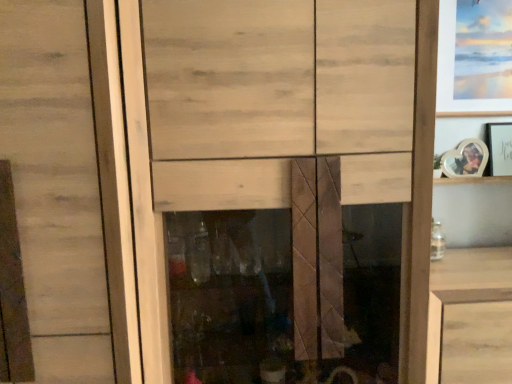
Question: Is wooden heart-shaped photo frame at upper right, which is counted as the 1th picture frame, starting from the bottom, looking in the opposite direction of matte white picture frame at upper right, which appears as the first picture frame when viewed from the top?

Choices:
 (A) yes
 (B) no

Answer: (B)

Question: Is wooden heart-shaped photo frame at upper right, which is counted as the 1th picture frame, starting from the bottom, taller than matte white picture frame at upper right, which appears as the first picture frame when viewed from the top?

Choices:
 (A) no
 (B) yes

Answer: (A)

Question: Is wooden heart-shaped photo frame at upper right, the 3th picture frame when ordered from top to bottom, at the left side of matte white picture frame at upper right, which appears as the first picture frame when viewed from the top?

Choices:
 (A) no
 (B) yes

Answer: (B)

Question: From a real-world perspective, is wooden heart-shaped photo frame at upper right, which is counted as the 1th picture frame, starting from the bottom, located beneath matte white picture frame at upper right, which appears as the first picture frame when viewed from the top?

Choices:
 (A) no
 (B) yes

Answer: (B)

Question: From a real-world perspective, is wooden heart-shaped photo frame at upper right, the 3th picture frame when ordered from top to bottom, on matte white picture frame at upper right, which appears as the first picture frame when viewed from the top?

Choices:
 (A) yes
 (B) no

Answer: (B)

Question: Does wooden heart-shaped photo frame at upper right, which is counted as the 1th picture frame, starting from the bottom, appear on the right side of matte white picture frame at upper right, which appears as the first picture frame when viewed from the top?

Choices:
 (A) no
 (B) yes

Answer: (A)

Question: From a real-world perspective, is wooden cabinet at lower right under matte white picture frame at upper right, the 3th picture frame ordered from the bottom?

Choices:
 (A) no
 (B) yes

Answer: (B)

Question: Is wooden cabinet at lower right directly adjacent to matte white picture frame at upper right, which appears as the first picture frame when viewed from the top?

Choices:
 (A) yes
 (B) no

Answer: (B)

Question: Does wooden cabinet at lower right have a greater height compared to matte white picture frame at upper right, the 3th picture frame ordered from the bottom?

Choices:
 (A) yes
 (B) no

Answer: (A)

Question: Considering the relative sizes of wooden cabinet at lower right and matte white picture frame at upper right, which appears as the first picture frame when viewed from the top, in the image provided, is wooden cabinet at lower right bigger than matte white picture frame at upper right, which appears as the first picture frame when viewed from the top,?

Choices:
 (A) yes
 (B) no

Answer: (A)

Question: Is wooden cabinet at lower right positioned behind matte white picture frame at upper right, the 3th picture frame ordered from the bottom?

Choices:
 (A) no
 (B) yes

Answer: (A)

Question: Is wooden cabinet at lower right to the right of matte white picture frame at upper right, the 3th picture frame ordered from the bottom, from the viewer's perspective?

Choices:
 (A) yes
 (B) no

Answer: (B)

Question: Is wooden heart-shaped photo frame at upper right, which is counted as the 1th picture frame, starting from the bottom, beside wooden photo frame at upper right, the second picture frame ordered from the bottom?

Choices:
 (A) no
 (B) yes

Answer: (B)